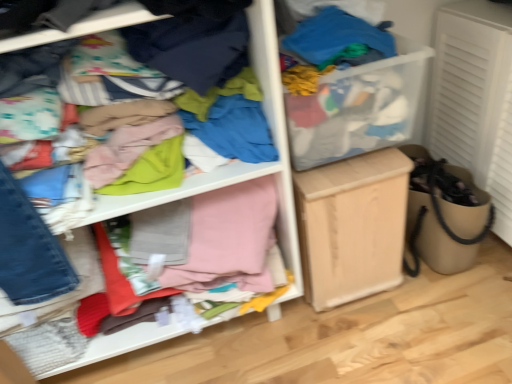
You are a GUI agent. You are given a task and a screenshot of the screen. Output one action in this format:
    pyautogui.click(x=<x>, y=<y>)
    Task: Click on the light wood cabinet at center
    The image size is (512, 384).
    Given the screenshot: What is the action you would take?
    pyautogui.click(x=352, y=226)

What do you see at coordinates (352, 226) in the screenshot? The width and height of the screenshot is (512, 384). I see `light wood cabinet at center` at bounding box center [352, 226].

The height and width of the screenshot is (384, 512). Describe the element at coordinates (239, 161) in the screenshot. I see `cloth at left` at that location.

You are a GUI agent. You are given a task and a screenshot of the screen. Output one action in this format:
    pyautogui.click(x=<x>, y=<y>)
    Task: Click on the cloth at left
    This screenshot has width=512, height=384.
    Given the screenshot: What is the action you would take?
    pyautogui.click(x=239, y=161)

Measure the distance between point (142, 195) and camera.

Point (142, 195) is 37.52 inches away from camera.

Identify the location of light wood cabinet at center. (352, 226).

Which object is positioned more to the right, light wood cabinet at center or cloth at left?

Positioned to the right is light wood cabinet at center.

Considering their positions, is light wood cabinet at center located in front of or behind cloth at left?

In the image, light wood cabinet at center appears behind cloth at left.

Between point (370, 169) and point (172, 337), which one is positioned in front?

Point (370, 169)

From the image's perspective, does light wood cabinet at center appear higher than cloth at left?

No.

From a real-world perspective, does light wood cabinet at center sit lower than cloth at left?

Yes, from a real-world perspective, light wood cabinet at center is below cloth at left.

Considering the sizes of objects light wood cabinet at center and cloth at left in the image provided, who is wider, light wood cabinet at center or cloth at left?

cloth at left is wider.

Between light wood cabinet at center and cloth at left, which one has more height?

cloth at left.

Is light wood cabinet at center bigger or smaller than cloth at left?

Clearly, light wood cabinet at center is smaller in size than cloth at left.

From the picture: Is light wood cabinet at center located outside cloth at left?

Absolutely, light wood cabinet at center is external to cloth at left.

Is light wood cabinet at center placed right next to cloth at left?

light wood cabinet at center and cloth at left are clearly separated.

Consider the image. Is light wood cabinet at center facing towards cloth at left?

No, light wood cabinet at center is not oriented towards cloth at left.

From the picture: What's the angular difference between light wood cabinet at center and cloth at left's facing directions?

0.297 degrees.

You are a GUI agent. You are given a task and a screenshot of the screen. Output one action in this format:
    pyautogui.click(x=<x>, y=<y>)
    Task: Click on the shelf in front of the light wood cabinet at center
    
    Given the screenshot: What is the action you would take?
    pyautogui.click(x=239, y=161)

Visually, is cloth at left positioned to the left or to the right of light wood cabinet at center?

Based on their positions, cloth at left is located to the left of light wood cabinet at center.

Which object is further away from the camera, cloth at left or light wood cabinet at center?

light wood cabinet at center is further away from the camera.

Does point (133, 339) come closer to viewer compared to point (401, 237)?

Yes, it is in front of point (401, 237).

From the image's perspective, is cloth at left above or below light wood cabinet at center?

Based on their image positions, cloth at left is located above light wood cabinet at center.

From a real-world perspective, is cloth at left under light wood cabinet at center?

No, from a real-world perspective, cloth at left is not under light wood cabinet at center.

Considering the sizes of objects cloth at left and light wood cabinet at center in the image provided, who is wider, cloth at left or light wood cabinet at center?

cloth at left is wider.

In terms of height, does cloth at left look taller or shorter compared to light wood cabinet at center?

cloth at left is taller than light wood cabinet at center.

Considering the relative sizes of cloth at left and light wood cabinet at center in the image provided, is cloth at left smaller than light wood cabinet at center?

Incorrect, cloth at left is not smaller in size than light wood cabinet at center.

Is light wood cabinet at center completely or partially inside cloth at left?

Definitely not — light wood cabinet at center is not inside cloth at left.

Is cloth at left not near light wood cabinet at center?

No, cloth at left is in close proximity to light wood cabinet at center.

Is cloth at left looking in the opposite direction of light wood cabinet at center?

No, light wood cabinet at center is not at the back of cloth at left.

What's the angular difference between cloth at left and light wood cabinet at center's facing directions?

cloth at left and light wood cabinet at center are facing 0.297 degrees away from each other.

I want to click on cabinetry behind the cloth at left, so click(x=352, y=226).

You are a GUI agent. You are given a task and a screenshot of the screen. Output one action in this format:
    pyautogui.click(x=<x>, y=<y>)
    Task: Click on the cabinetry directly beneath the cloth at left (from a real-world perspective)
    The height and width of the screenshot is (384, 512).
    Given the screenshot: What is the action you would take?
    [x=352, y=226]

Where is `shelf above the light wood cabinet at center (from a real-world perspective)`? shelf above the light wood cabinet at center (from a real-world perspective) is located at coordinates point(239,161).